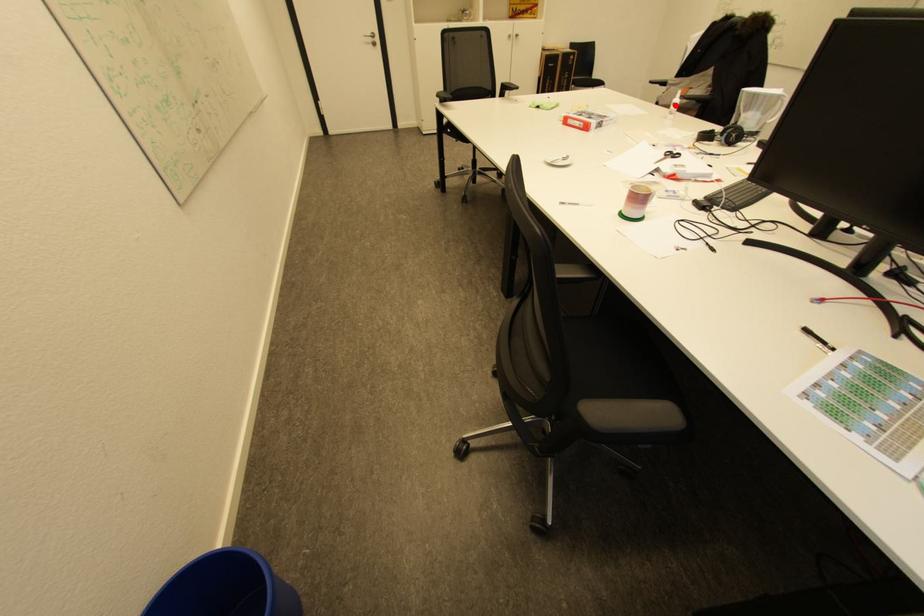
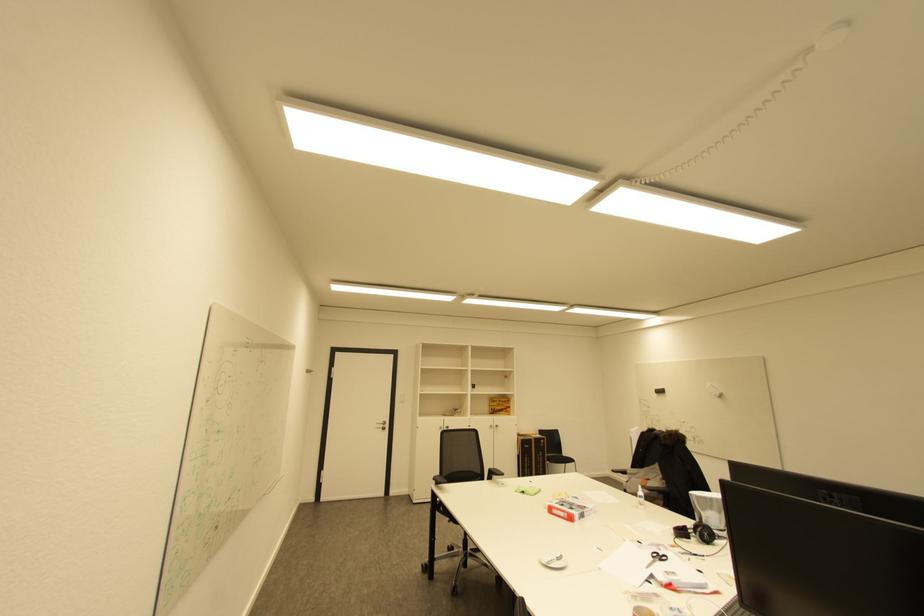
Find the pixel in the second image that matches the highlighted location in the first image.

(641, 496)